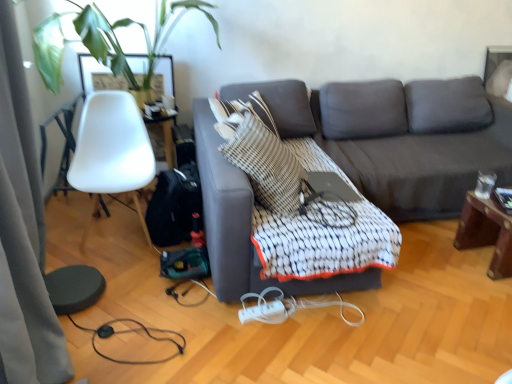
You are a GUI agent. You are given a task and a screenshot of the screen. Output one action in this format:
    pyautogui.click(x=<x>, y=<y>)
    Task: Click on the vacant space in front of white plastic extension cord at lower center
    Image resolution: width=512 pixels, height=384 pixels.
    Given the screenshot: What is the action you would take?
    pyautogui.click(x=260, y=343)